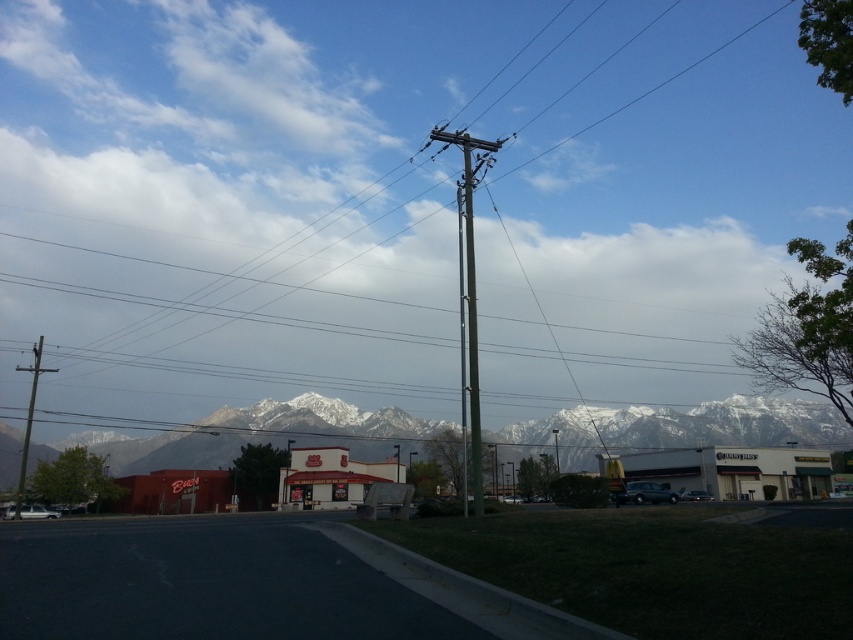
Is green metallic pole at center shorter than snowy white mountains at center?

No, green metallic pole at center is not shorter than snowy white mountains at center.

Looking at this image, between green metallic pole at center and snowy white mountains at center, which one has more height?

Standing taller between the two is green metallic pole at center.

Does point (640, 269) lie behind point (596, 422)?

Yes, point (640, 269) is farther from viewer.

This screenshot has height=640, width=853. Find the location of `green metallic pole at center`. green metallic pole at center is located at coordinates (399, 196).

The width and height of the screenshot is (853, 640). I want to click on green metallic pole at center, so click(399, 196).

Is green metallic pole at center to the left of brown wooden telegraph pole at left from the viewer's perspective?

Incorrect, green metallic pole at center is not on the left side of brown wooden telegraph pole at left.

Where is `green metallic pole at center`? green metallic pole at center is located at coordinates (399, 196).

Locate an element on the screen. green metallic pole at center is located at coordinates (399, 196).

Does green wooden telegraph pole at center lie in front of brown wooden telegraph pole at left?

Yes, it is in front of brown wooden telegraph pole at left.

Measure the distance between green wooden telegraph pole at center and camera.

23.96 meters

Is point (469, 380) behind point (26, 436)?

That is False.

Where is `green wooden telegraph pole at center`? Image resolution: width=853 pixels, height=640 pixels. green wooden telegraph pole at center is located at coordinates (469, 284).